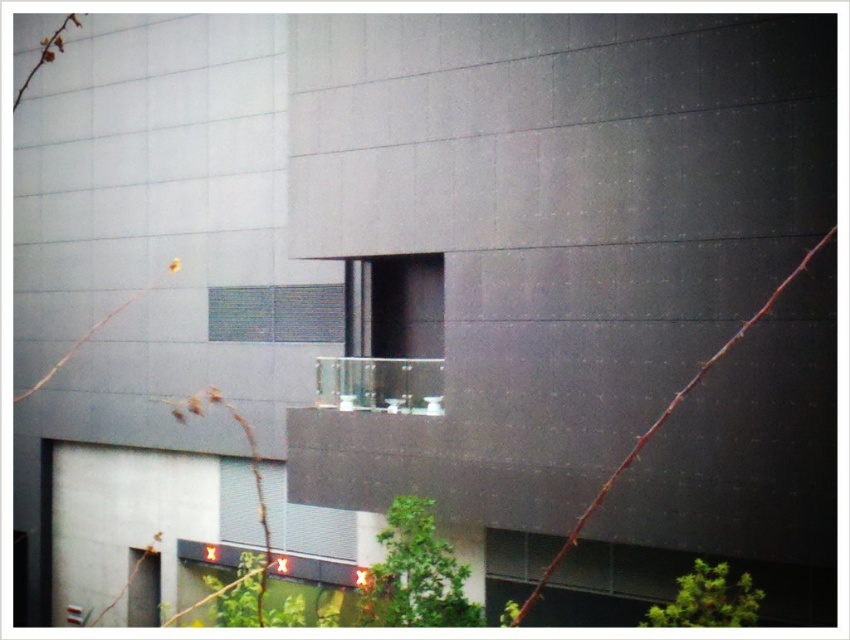
Is point (344, 371) positioned behind point (244, 492)?

That is False.

Can you confirm if transparent glass window at center is bigger than clear glass window at lower center?

Incorrect, transparent glass window at center is not larger than clear glass window at lower center.

This screenshot has height=640, width=850. I want to click on transparent glass window at center, so click(394, 307).

The width and height of the screenshot is (850, 640). I want to click on transparent glass window at center, so pyautogui.click(x=394, y=307).

Is transparent glass window at center in front of clear glass balcony at center?

That is False.

Between point (403, 316) and point (326, 372), which one is positioned in front?

Point (326, 372)

You are a GUI agent. You are given a task and a screenshot of the screen. Output one action in this format:
    pyautogui.click(x=<x>, y=<y>)
    Task: Click on the transparent glass window at center
    This screenshot has height=640, width=850.
    Given the screenshot: What is the action you would take?
    pyautogui.click(x=394, y=307)

Is clear glass window at lower center thinner than clear glass balcony at center?

No, clear glass window at lower center is not thinner than clear glass balcony at center.

Is point (354, 532) positioned behind point (418, 372)?

That is True.

Find the location of a particular element. clear glass window at lower center is located at coordinates (306, 522).